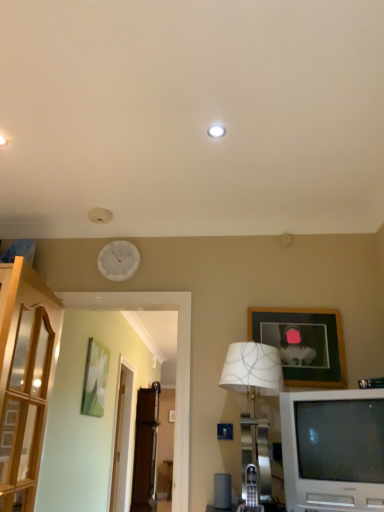
Question: From the image's perspective, relative to wooden picture frame at upper right, positioned as the 2th picture frame in bottom-to-top order, is white fabric lampshade at lower right above or below?

Choices:
 (A) above
 (B) below

Answer: (B)

Question: Does point (266, 424) appear closer or farther from the camera than point (311, 374)?

Choices:
 (A) closer
 (B) farther

Answer: (A)

Question: Which object is positioned closest to the transparent glass door at center, the 2th glass door from the front?

Choices:
 (A) white glossy clock at upper center
 (B) green matte painting at left, which ranks as the first picture frame in left-to-right order
 (C) clear glass door at left, the 1th glass door in the top-to-bottom sequence
 (D) wooden picture frame at upper right, positioned as the second picture frame in back-to-front order
 (E) white fabric lampshade at lower right

Answer: (B)

Question: Considering the real-world distances, which object is farthest from the transparent glass door at center, the 2th glass door from the front?

Choices:
 (A) wooden picture frame at upper right, which is the 1th picture frame in top-to-bottom order
 (B) white glossy clock at upper center
 (C) clear glass door at left, marked as the second glass door in a bottom-to-top arrangement
 (D) white plastic television at lower right
 (E) white fabric lampshade at lower right

Answer: (D)